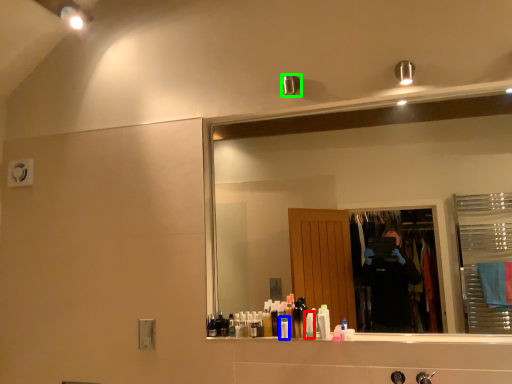
Question: Estimate the real-world distances between objects in this image. Which object is farther from toiletry (highlighted by a red box), toiletry (highlighted by a blue box) or shower (highlighted by a green box)?

Choices:
 (A) toiletry
 (B) shower

Answer: (B)